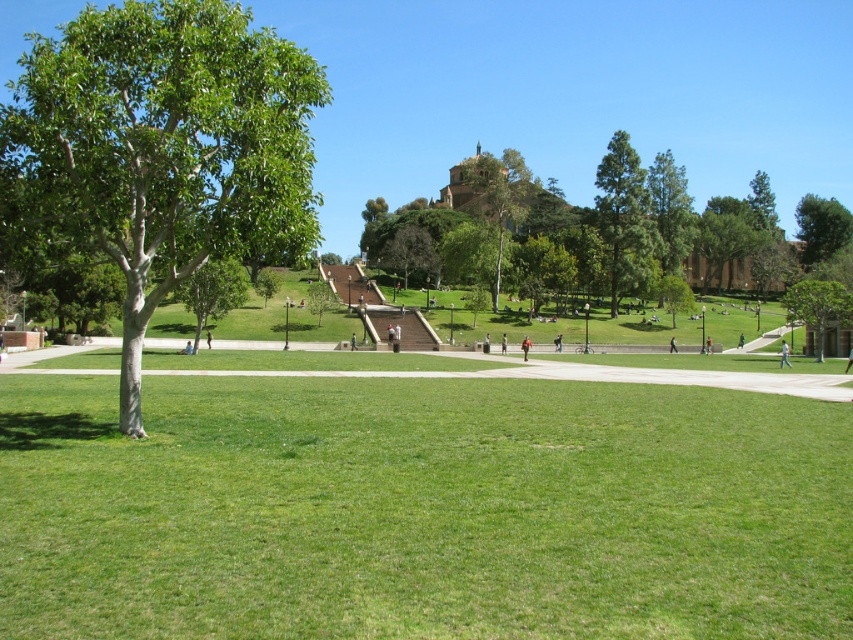
Question: Which point is farther to the camera?

Choices:
 (A) orange shirt at center
 (B) green textured tree at center
 (C) green grassy field at center
 (D) green leafy tree at center-left

Answer: (B)

Question: Is green leafy tree at right positioned at the back of light blue jeans at lower right?

Choices:
 (A) yes
 (B) no

Answer: (A)

Question: Which object appears farthest from the camera in this image?

Choices:
 (A) green leafy tree at upper right
 (B) green leafy tree at upper center

Answer: (A)

Question: Can you confirm if light blue jeans at lower right is smaller than orange shirt at center?

Choices:
 (A) no
 (B) yes

Answer: (A)

Question: Can you confirm if green grassy field at center is positioned below orange shirt at center?

Choices:
 (A) no
 (B) yes

Answer: (B)

Question: Which is farther from the green textured tree at center?

Choices:
 (A) green leafy tree at upper right
 (B) green leafy tree at left

Answer: (A)